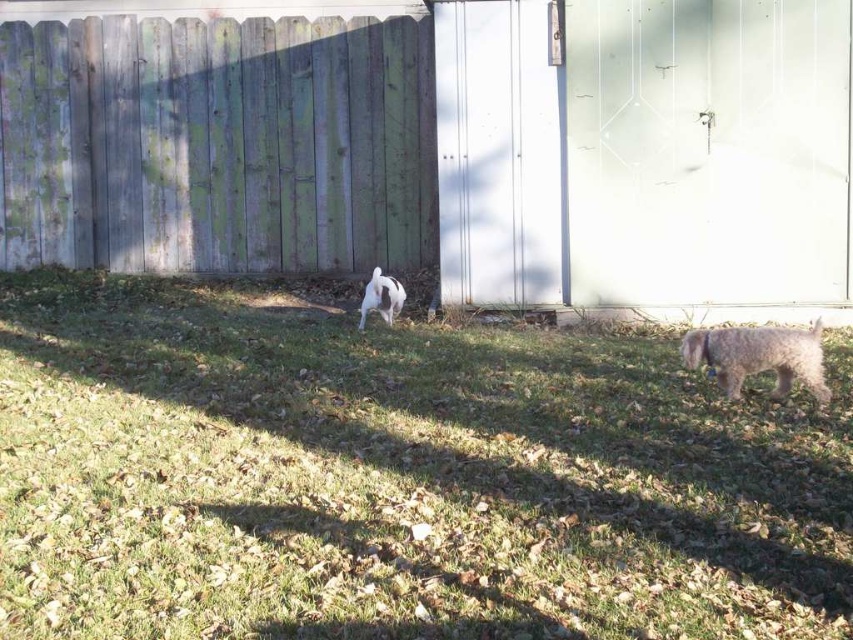
Does fuzzy gray dog at lower right appear under white fur dog at center?

Yes.

You are a GUI agent. You are given a task and a screenshot of the screen. Output one action in this format:
    pyautogui.click(x=<x>, y=<y>)
    Task: Click on the fuzzy gray dog at lower right
    The width and height of the screenshot is (853, 640).
    Given the screenshot: What is the action you would take?
    pyautogui.click(x=758, y=356)

Is weathered wood fence at upper left above white fur dog at center?

Indeed, weathered wood fence at upper left is positioned over white fur dog at center.

Can you confirm if weathered wood fence at upper left is smaller than white fur dog at center?

No, weathered wood fence at upper left is not smaller than white fur dog at center.

Describe the element at coordinates (218, 144) in the screenshot. The image size is (853, 640). I see `weathered wood fence at upper left` at that location.

Identify the location of weathered wood fence at upper left. This screenshot has width=853, height=640. (218, 144).

Can you confirm if weathered wood fence at upper left is bigger than fuzzy gray dog at lower right?

Indeed, weathered wood fence at upper left has a larger size compared to fuzzy gray dog at lower right.

Which is more to the left, weathered wood fence at upper left or fuzzy gray dog at lower right?

Positioned to the left is weathered wood fence at upper left.

Which is behind, point (416, 125) or point (741, 340)?

The point (416, 125) is more distant.

Locate an element on the screen. This screenshot has width=853, height=640. weathered wood fence at upper left is located at coordinates (218, 144).